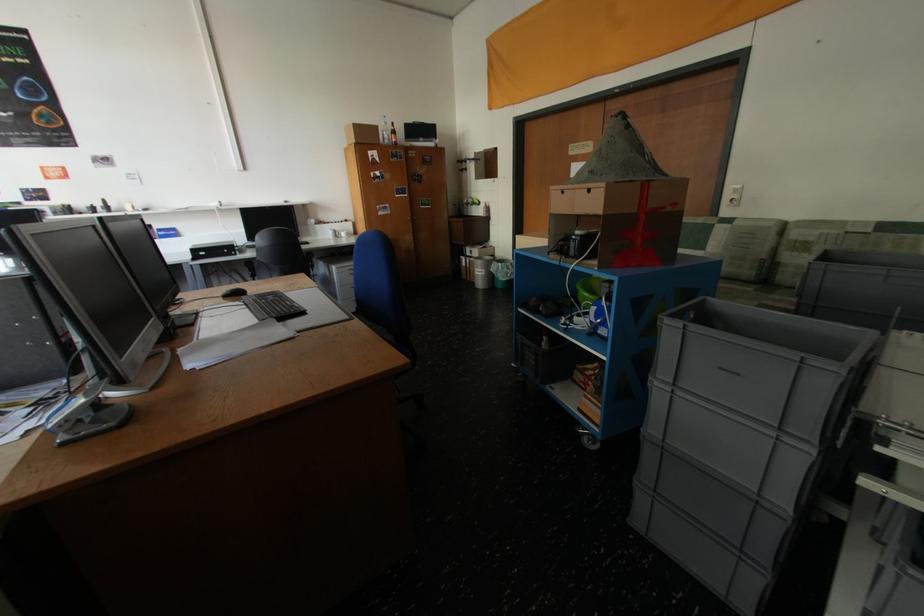
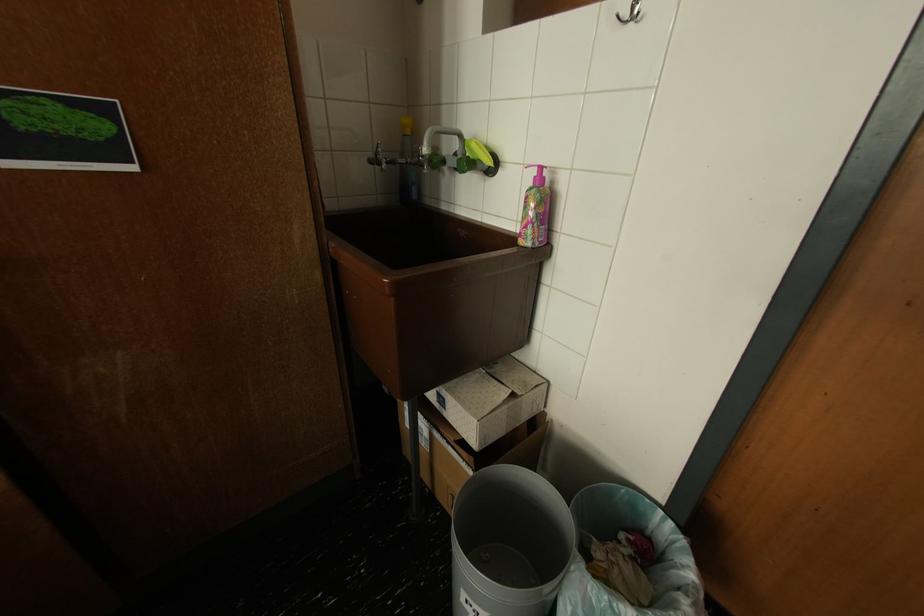
Find the pixel in the second image that matches pixel 480 200 in the first image.

(468, 138)